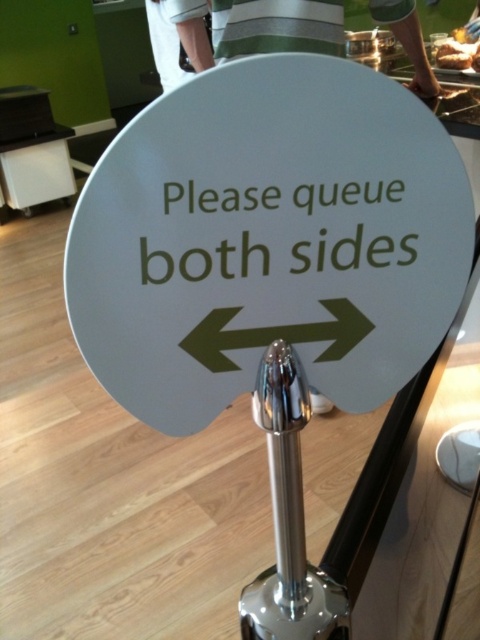
Question: Among these points, which one is nearest to the camera?

Choices:
 (A) (251, 604)
 (B) (442, 65)
 (C) (74, 275)

Answer: (C)

Question: Which of these objects is positioned closest to the brown bread at upper right?

Choices:
 (A) white glossy sign at center
 (B) polished metal pole at center

Answer: (A)

Question: Can you confirm if white glossy sign at center is wider than brown bread at upper right?

Choices:
 (A) yes
 (B) no

Answer: (A)

Question: Among these points, which one is nearest to the camera?

Choices:
 (A) (457, 60)
 (B) (328, 99)
 (C) (326, 584)

Answer: (B)

Question: Observing the image, what is the correct spatial positioning of white glossy sign at center in reference to polished metal pole at center?

Choices:
 (A) left
 (B) right

Answer: (A)

Question: Can you confirm if white glossy sign at center is positioned to the left of brown bread at upper right?

Choices:
 (A) no
 (B) yes

Answer: (B)